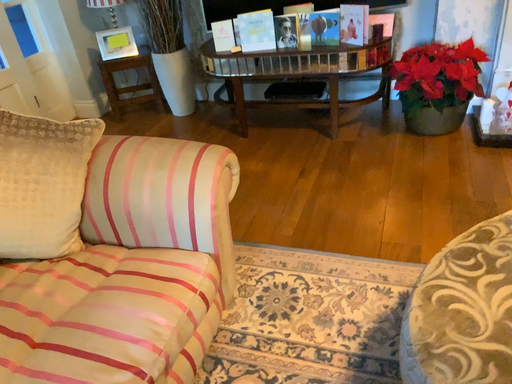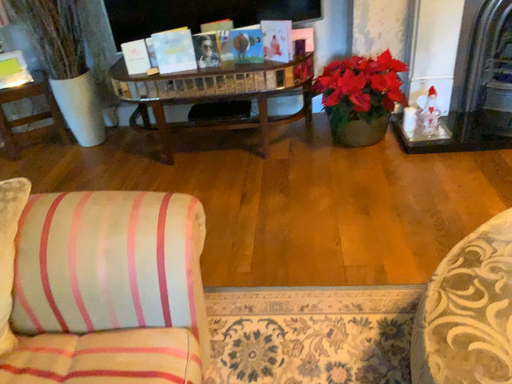
Question: Which way did the camera rotate in the video?

Choices:
 (A) rotated right
 (B) rotated left

Answer: (A)